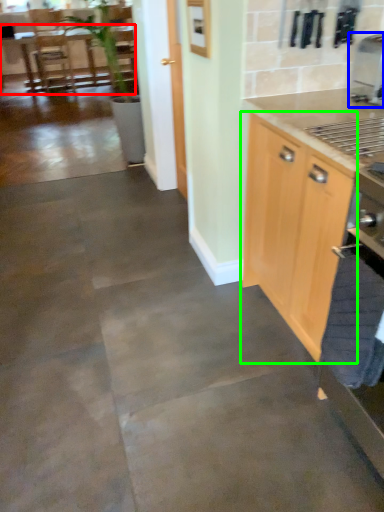
Question: Based on their relative distances, which object is farther from table (highlighted by a red box)? Choose from coffee machine (highlighted by a blue box) and cabinetry (highlighted by a green box).

Choices:
 (A) coffee machine
 (B) cabinetry

Answer: (B)